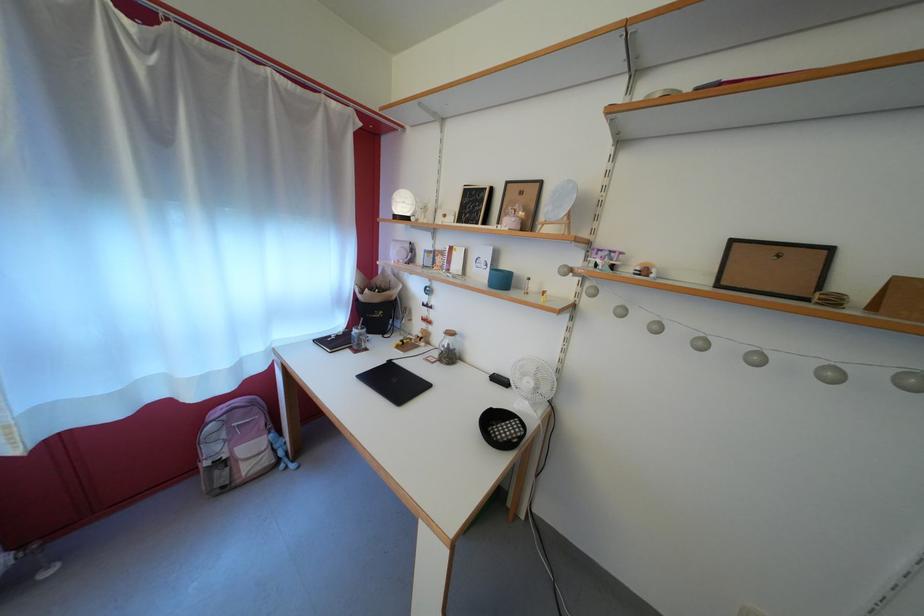
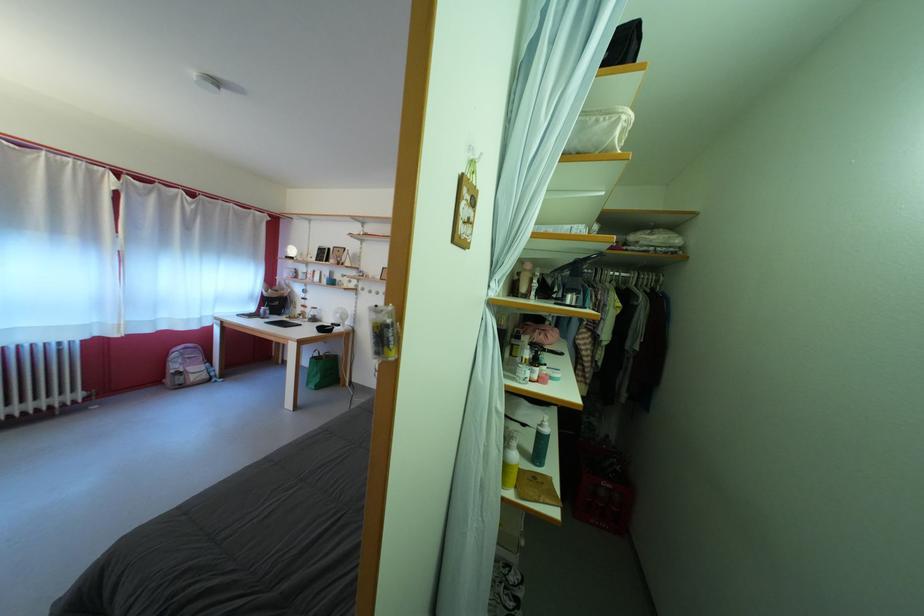
The point at (x=458, y=363) is marked in the first image. Where is the corresponding point in the second image?

(322, 325)